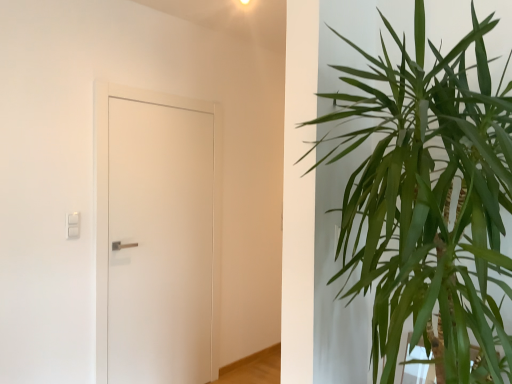
Question: Is green leafy plant at right wider than white matte door at left?

Choices:
 (A) no
 (B) yes

Answer: (B)

Question: Can you confirm if green leafy plant at right is thinner than white matte door at left?

Choices:
 (A) no
 (B) yes

Answer: (A)

Question: From a real-world perspective, is green leafy plant at right under white matte door at left?

Choices:
 (A) no
 (B) yes

Answer: (A)

Question: Is the surface of green leafy plant at right in direct contact with white matte door at left?

Choices:
 (A) no
 (B) yes

Answer: (A)

Question: Is green leafy plant at right turned away from white matte door at left?

Choices:
 (A) no
 (B) yes

Answer: (A)

Question: Would you say green leafy plant at right is a long distance from white matte door at left?

Choices:
 (A) yes
 (B) no

Answer: (A)

Question: Is white matte door at left far away from green leafy plant at right?

Choices:
 (A) no
 (B) yes

Answer: (B)

Question: From a real-world perspective, is white matte door at left physically above green leafy plant at right?

Choices:
 (A) no
 (B) yes

Answer: (A)

Question: Does white matte door at left have a lesser height compared to green leafy plant at right?

Choices:
 (A) yes
 (B) no

Answer: (B)

Question: Is white matte door at left facing towards green leafy plant at right?

Choices:
 (A) yes
 (B) no

Answer: (A)

Question: Is white matte door at left at the left side of green leafy plant at right?

Choices:
 (A) no
 (B) yes

Answer: (B)

Question: Does white matte door at left contain green leafy plant at right?

Choices:
 (A) yes
 (B) no

Answer: (B)

Question: Looking at their shapes, would you say white matte door at left is wider or thinner than green leafy plant at right?

Choices:
 (A) thin
 (B) wide

Answer: (A)